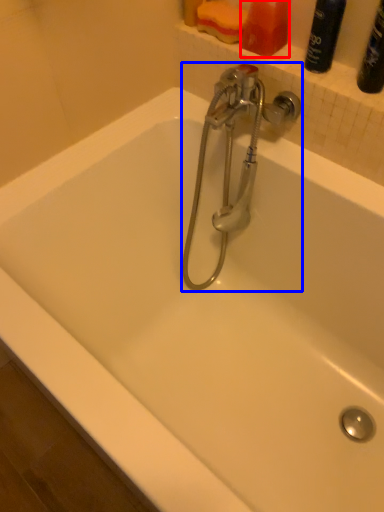
Question: Among these objects, which one is nearest to the camera, toiletry (highlighted by a red box) or tap (highlighted by a blue box)?

Choices:
 (A) toiletry
 (B) tap

Answer: (B)